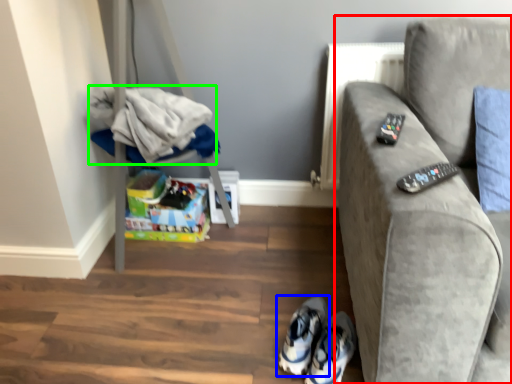
Question: Estimate the real-world distances between objects in this image. Which object is closer to studio couch (highlighted by a red box), footwear (highlighted by a blue box) or laundry (highlighted by a green box)?

Choices:
 (A) footwear
 (B) laundry

Answer: (A)